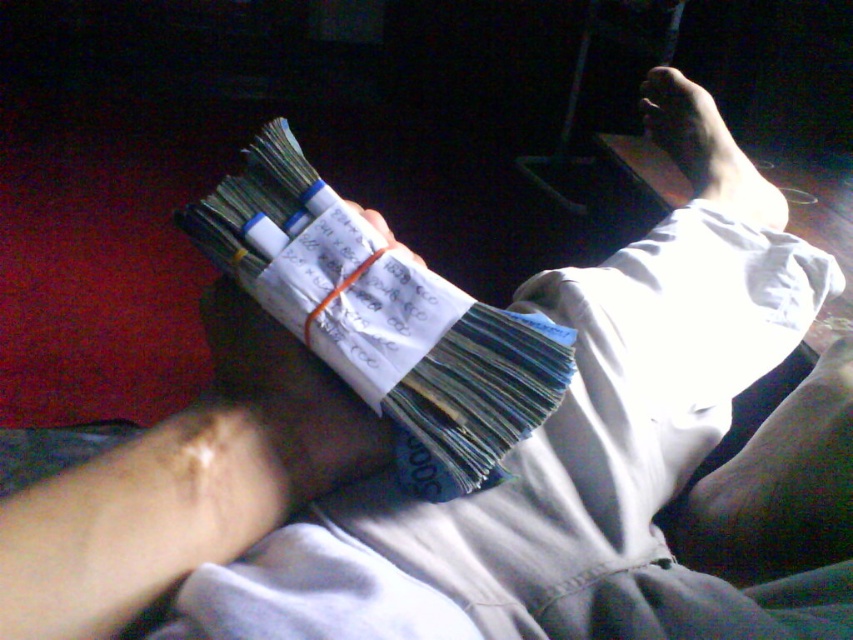
Can you confirm if white paper money at center is smaller than smooth skin foot at upper right?

No.

Describe the element at coordinates (384, 320) in the screenshot. The height and width of the screenshot is (640, 853). I see `white paper money at center` at that location.

Identify the location of white paper money at center. Image resolution: width=853 pixels, height=640 pixels. (384, 320).